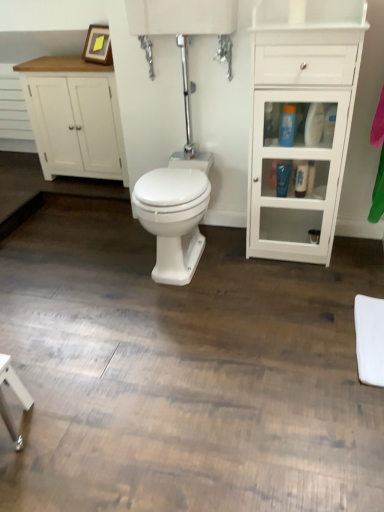
Find the location of a particular element. This screenshot has width=384, height=512. spots to the right of white glossy bidet at center is located at coordinates (256, 268).